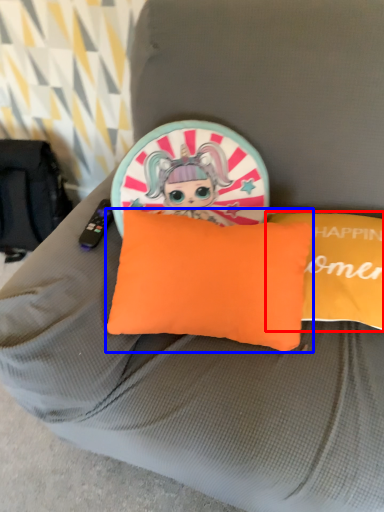
Question: Which point is further to the camera, pillow (highlighted by a red box) or pillow (highlighted by a blue box)?

Choices:
 (A) pillow
 (B) pillow

Answer: (A)